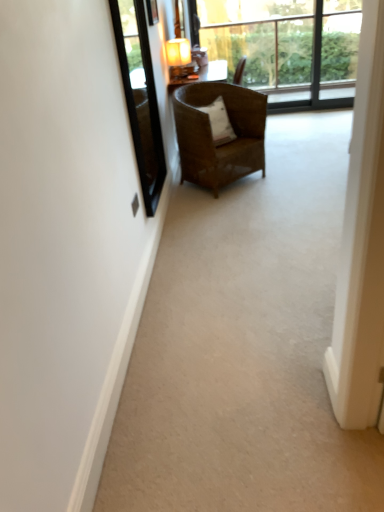
Question: Should I look upward or downward to see matte brown lamp at upper center?

Choices:
 (A) up
 (B) down

Answer: (A)

Question: From the image's perspective, is white glossy screen door at right over matte brown lamp at upper center?

Choices:
 (A) yes
 (B) no

Answer: (B)

Question: Could you tell me if white glossy screen door at right is turned towards matte brown lamp at upper center?

Choices:
 (A) yes
 (B) no

Answer: (B)

Question: Considering the relative positions of white glossy screen door at right and matte brown lamp at upper center in the image provided, is white glossy screen door at right to the left of matte brown lamp at upper center from the viewer's perspective?

Choices:
 (A) no
 (B) yes

Answer: (A)

Question: From a real-world perspective, is white glossy screen door at right under matte brown lamp at upper center?

Choices:
 (A) no
 (B) yes

Answer: (B)

Question: Is white glossy screen door at right shorter than matte brown lamp at upper center?

Choices:
 (A) no
 (B) yes

Answer: (A)

Question: Are white glossy screen door at right and matte brown lamp at upper center far apart?

Choices:
 (A) no
 (B) yes

Answer: (B)

Question: Is white soft pillow at center thinner than matte brown lamp at upper center?

Choices:
 (A) yes
 (B) no

Answer: (B)

Question: From a real-world perspective, is white soft pillow at center located higher than matte brown lamp at upper center?

Choices:
 (A) no
 (B) yes

Answer: (A)

Question: Considering the relative sizes of white soft pillow at center and matte brown lamp at upper center in the image provided, is white soft pillow at center shorter than matte brown lamp at upper center?

Choices:
 (A) yes
 (B) no

Answer: (A)

Question: From the image's perspective, is white soft pillow at center on matte brown lamp at upper center?

Choices:
 (A) yes
 (B) no

Answer: (B)

Question: Is white soft pillow at center to the left of matte brown lamp at upper center from the viewer's perspective?

Choices:
 (A) yes
 (B) no

Answer: (B)

Question: From the image's perspective, is white soft pillow at center below matte brown lamp at upper center?

Choices:
 (A) yes
 (B) no

Answer: (A)

Question: From a real-world perspective, is transparent glass window at upper center below transparent glass window screen at upper left?

Choices:
 (A) no
 (B) yes

Answer: (B)